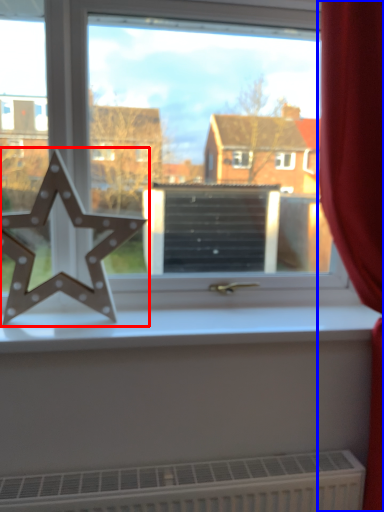
Question: Which object appears closest to the camera in this image, letter (highlighted by a red box) or curtain (highlighted by a blue box)?

Choices:
 (A) letter
 (B) curtain

Answer: (B)